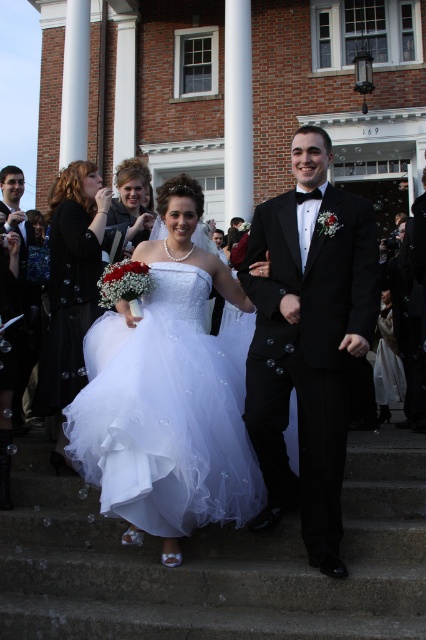
Consider the image. You are a photographer standing at a certain distance from the white tulle dress at center. If you want to capture the dress in a closeup shot without moving closer, what adjustment should you make to your camera?

The white tulle dress at center is 16.39 meters away from the camera. To capture a closeup shot without moving closer, you should use a zoom lens to magnify the image.

You are a photographer standing at the camera position. You want to capture a closeup shot of the black satin tuxedo at center. Given that your camera can focus on objects within 15 meters, will you be able to take the photo without moving closer?

The distance between the black satin tuxedo at center and the camera is 16.11 meters, which is beyond the camera focus range of 15 meters. Therefore, you cannot take the photo without moving closer.